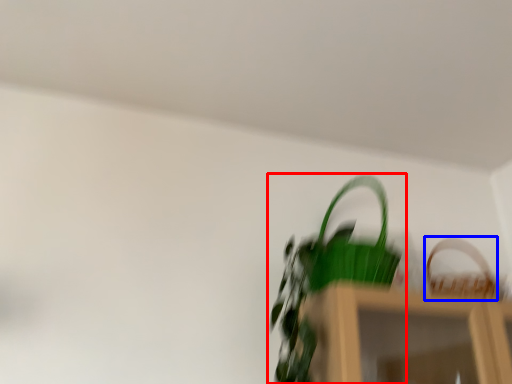
Question: Which of the following is the closest to the observer, houseplant (highlighted by a red box) or basket (highlighted by a blue box)?

Choices:
 (A) houseplant
 (B) basket

Answer: (A)